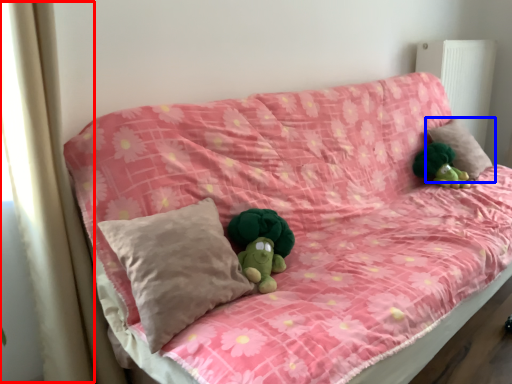
Question: Which point is closer to the camera, curtain (highlighted by a red box) or pillow (highlighted by a blue box)?

Choices:
 (A) curtain
 (B) pillow

Answer: (A)